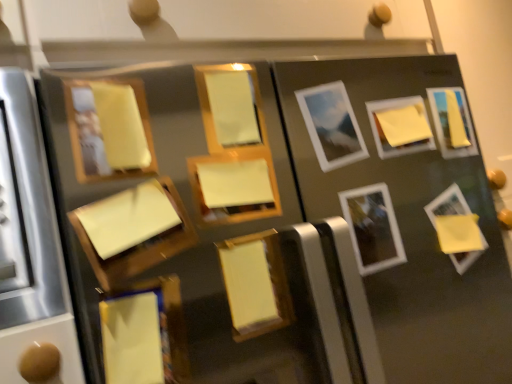
Question: Can you confirm if matte wood picture frame at center, positioned as the 7th picture frame in right-to-left order, is smaller than yellow matte picture frame at upper right, which is counted as the eleventh picture frame, starting from the left?

Choices:
 (A) yes
 (B) no

Answer: (B)

Question: Is matte wood picture frame at center, positioned as the 7th picture frame in right-to-left order, outside of yellow matte picture frame at upper right, which is counted as the eleventh picture frame, starting from the left?

Choices:
 (A) no
 (B) yes

Answer: (B)

Question: Does matte wood picture frame at center, the 5th picture frame in the left-to-right sequence, have a lesser width compared to yellow matte picture frame at upper right, which is counted as the eleventh picture frame, starting from the left?

Choices:
 (A) yes
 (B) no

Answer: (B)

Question: From the image's perspective, is matte wood picture frame at center, the 5th picture frame in the left-to-right sequence, over yellow matte picture frame at upper right, which is counted as the eleventh picture frame, starting from the left?

Choices:
 (A) no
 (B) yes

Answer: (A)

Question: From a real-world perspective, is matte wood picture frame at center, the 5th picture frame in the left-to-right sequence, positioned over yellow matte picture frame at upper right, the 1th picture frame viewed from the right, based on gravity?

Choices:
 (A) no
 (B) yes

Answer: (A)

Question: From the image's perspective, is matte wood picture frame at center, positioned as the 7th picture frame in right-to-left order, located beneath yellow matte picture frame at upper right, which is counted as the eleventh picture frame, starting from the left?

Choices:
 (A) yes
 (B) no

Answer: (A)

Question: Considering the relative positions of matte wood picture frame at upper left, which ranks as the first picture frame in left-to-right order, and matte yellow picture frame at center, placed as the fourth picture frame when sorted from left to right, in the image provided, is matte wood picture frame at upper left, which ranks as the first picture frame in left-to-right order, to the right of matte yellow picture frame at center, placed as the fourth picture frame when sorted from left to right, from the viewer's perspective?

Choices:
 (A) no
 (B) yes

Answer: (A)

Question: Can matte yellow picture frame at center, placed as the fourth picture frame when sorted from left to right, be found inside matte wood picture frame at upper left, which is counted as the eleventh picture frame, starting from the right?

Choices:
 (A) yes
 (B) no

Answer: (B)

Question: From the image's perspective, is matte wood picture frame at upper left, which ranks as the first picture frame in left-to-right order, on matte yellow picture frame at center, which is the 8th picture frame in right-to-left order?

Choices:
 (A) no
 (B) yes

Answer: (A)

Question: From a real-world perspective, does matte wood picture frame at upper left, which ranks as the first picture frame in left-to-right order, sit lower than matte yellow picture frame at center, placed as the fourth picture frame when sorted from left to right?

Choices:
 (A) yes
 (B) no

Answer: (A)

Question: Is matte yellow picture frame at center, placed as the fourth picture frame when sorted from left to right, at the back of matte wood picture frame at upper left, which is counted as the eleventh picture frame, starting from the right?

Choices:
 (A) yes
 (B) no

Answer: (B)

Question: From a real-world perspective, is matte wood picture frame at upper left, which is counted as the eleventh picture frame, starting from the right, physically above matte yellow picture frame at center, which is the 8th picture frame in right-to-left order?

Choices:
 (A) yes
 (B) no

Answer: (B)

Question: Is the depth of matte yellow picture frame at center, which is the 8th picture frame in right-to-left order, greater than that of yellow matte picture frame at center, acting as the sixth picture frame starting from the left?

Choices:
 (A) yes
 (B) no

Answer: (A)